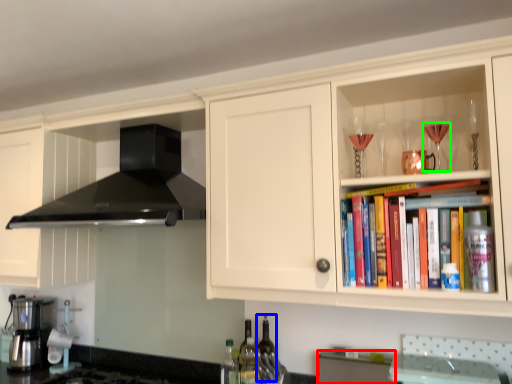
Question: Estimate the real-world distances between objects in this image. Which object is farther from cabinetry (highlighted by a red box), bottle (highlighted by a blue box) or wine glass (highlighted by a green box)?

Choices:
 (A) bottle
 (B) wine glass

Answer: (B)